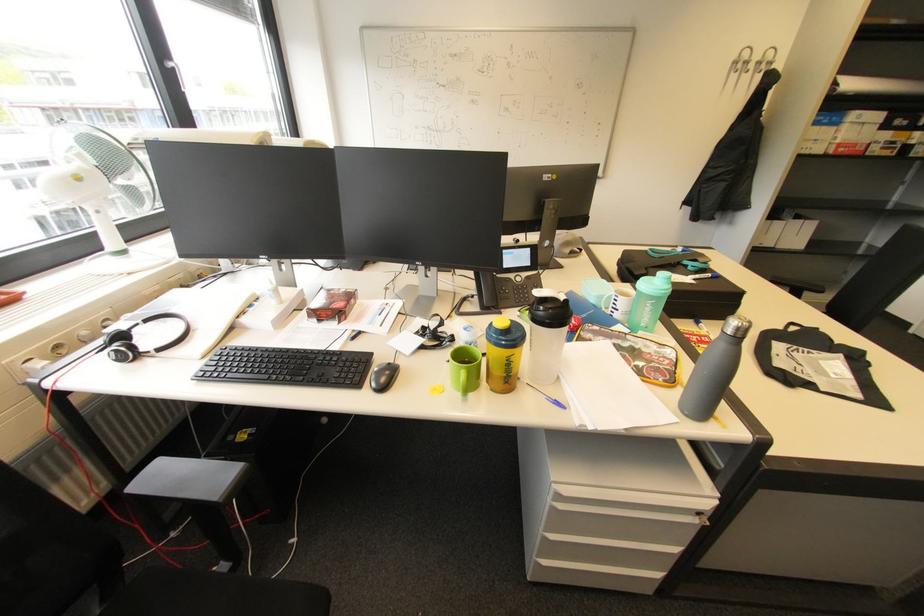
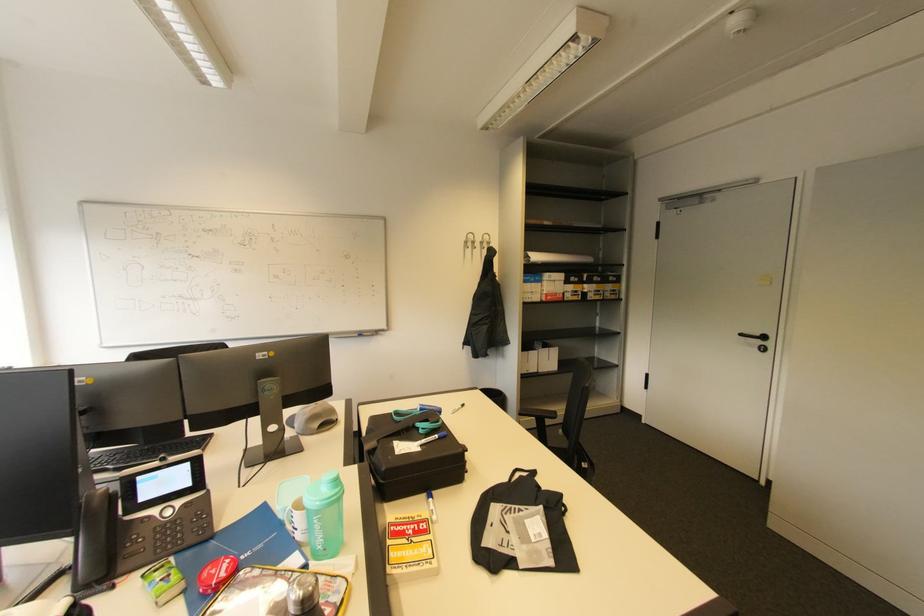
The point at (714, 275) is marked in the first image. Where is the corresponding point in the second image?

(441, 437)